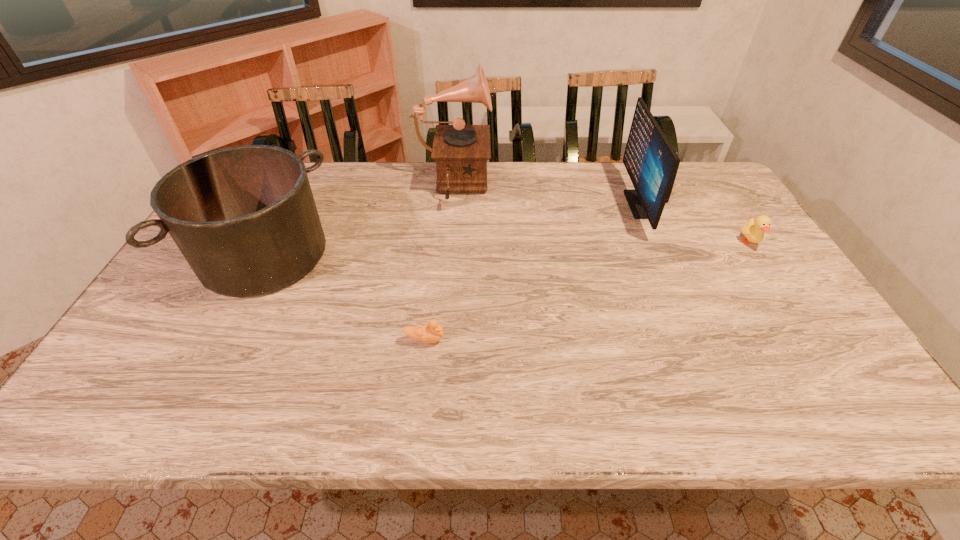
At what (x,y) coordinates should I click in order to perform the action: click on free space located 0.130m on the screen side of the fourth object from left to right. Please return your answer as a coordinate pair (x, y). The image size is (960, 540). Looking at the image, I should click on (588, 204).

Locate an element on the screen. Image resolution: width=960 pixels, height=540 pixels. vacant space located 0.290m on the back of the leftmost object is located at coordinates (311, 165).

Where is `free region located on the front-facing side of the fourth tallest object`? This screenshot has height=540, width=960. free region located on the front-facing side of the fourth tallest object is located at coordinates (828, 360).

Where is `vacant region located on the face of the left duckling`? The image size is (960, 540). vacant region located on the face of the left duckling is located at coordinates 484,340.

Where is `record player located at the far edge`? record player located at the far edge is located at coordinates (461, 151).

Where is `computer monitor that is at the far edge`? The image size is (960, 540). computer monitor that is at the far edge is located at coordinates (651, 162).

Identify the location of object located at the left edge. coord(244,217).

This screenshot has height=540, width=960. In order to click on object that is at the right edge in this screenshot , I will do `click(754, 230)`.

Find the location of a particular element. The height and width of the screenshot is (540, 960). vacant region at the far edge is located at coordinates (601, 171).

You are a GUI agent. You are given a task and a screenshot of the screen. Output one action in this format:
    pyautogui.click(x=<x>, y=<y>)
    Task: Click on the free space at the near edge of the desktop
    
    Given the screenshot: What is the action you would take?
    pyautogui.click(x=314, y=396)